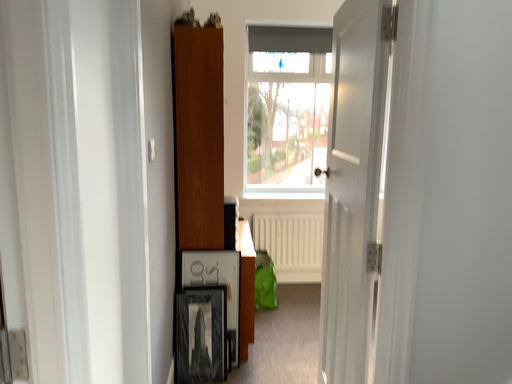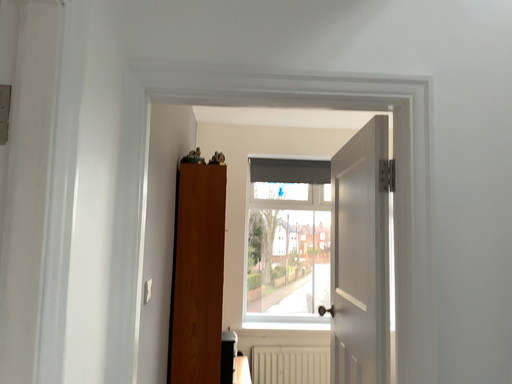
Question: How did the camera likely rotate when shooting the video?

Choices:
 (A) rotated upward
 (B) rotated downward

Answer: (A)